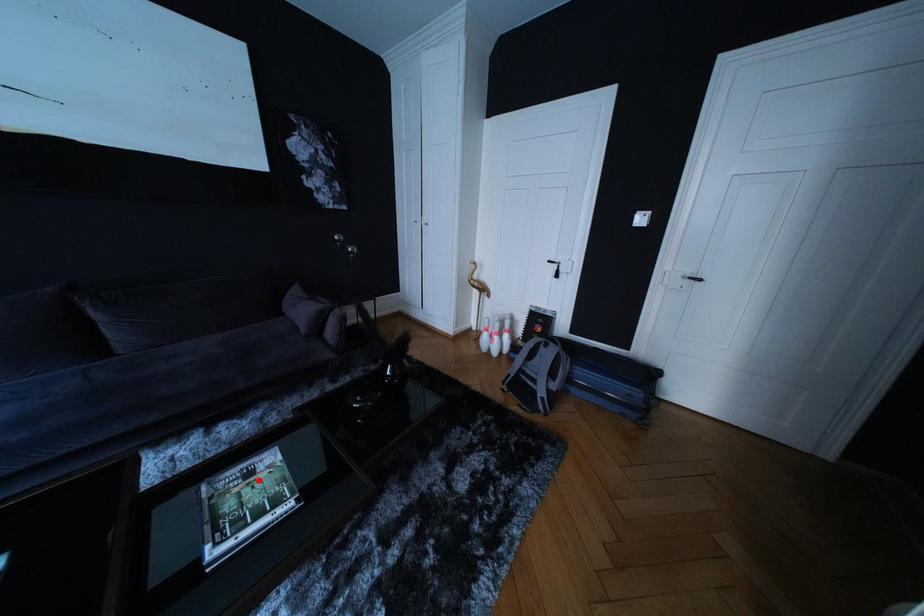
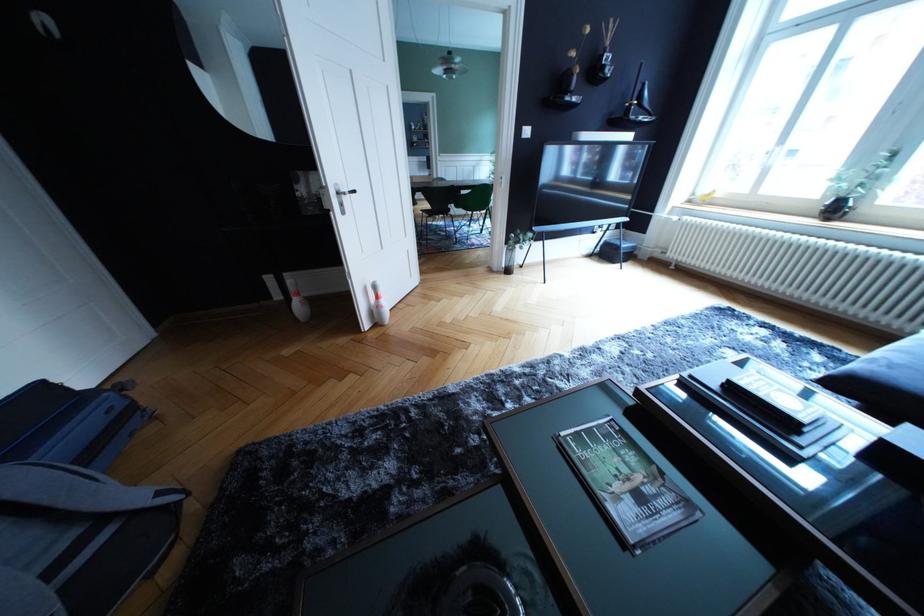
In the second image, find the point that corresponds to the highlighted location in the first image.

(649, 504)